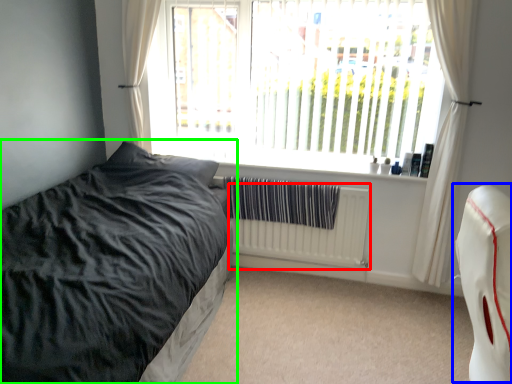
Question: Which object is positioned farthest from radiator (highlighted by a red box)? Select from swivel chair (highlighted by a blue box) and bed (highlighted by a green box).

Choices:
 (A) swivel chair
 (B) bed

Answer: (A)